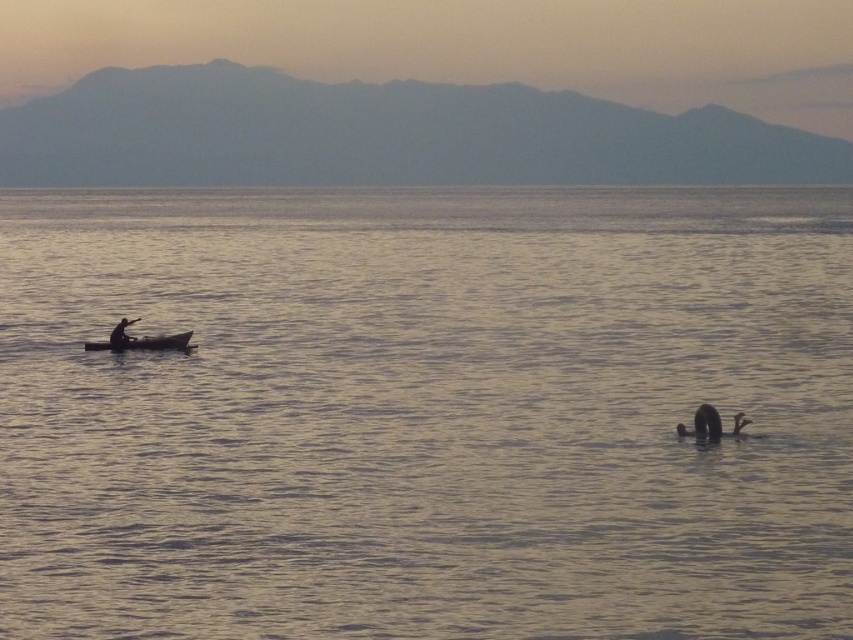
Does smooth water at center have a greater height compared to wooden canoe at left?

Yes.

The width and height of the screenshot is (853, 640). Describe the element at coordinates (426, 412) in the screenshot. I see `smooth water at center` at that location.

Is point (523, 429) positioned after point (86, 346)?

That is False.

This screenshot has width=853, height=640. I want to click on smooth water at center, so click(x=426, y=412).

Consider the image. Between wooden canoe at left and smooth skin person at left, which one has more height?

smooth skin person at left

Does wooden canoe at left have a lesser width compared to smooth skin person at left?

In fact, wooden canoe at left might be wider than smooth skin person at left.

Identify the location of wooden canoe at left. (144, 342).

You are a GUI agent. You are given a task and a screenshot of the screen. Output one action in this format:
    pyautogui.click(x=<x>, y=<y>)
    Task: Click on the wooden canoe at left
    
    Given the screenshot: What is the action you would take?
    pyautogui.click(x=144, y=342)

Does smooth water at center appear under smooth skin person at left?

No, smooth water at center is not below smooth skin person at left.

Is point (722, 400) positioned behind point (125, 339)?

No.

Identify the location of smooth water at center. (426, 412).